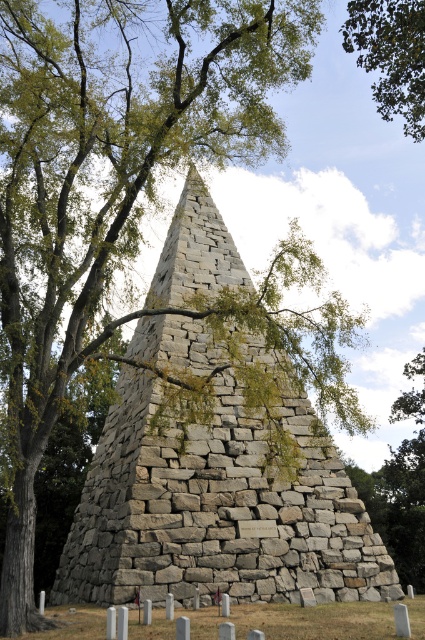
Consider the image. You are standing at the base of the gray stone pyramid at center and want to take a photo of the green leafy tree at upper right. Will the pyramid block your view of the tree?

The gray stone pyramid at center is in front of the green leafy tree at upper right, so the pyramid will block your view of the tree.

You are an archaeologist examining the site and need to determine which object occupies more space in the image. Based on the scene, which is bigger between the gray stone pyramid at center and the green leafy tree at upper right?

The gray stone pyramid at center is larger in size than the green leafy tree at upper right, so the gray stone pyramid at center occupies more space in the image.